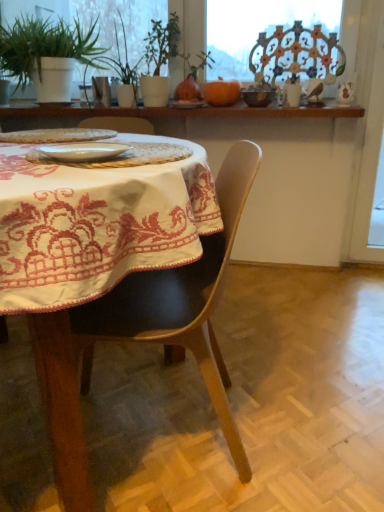
Identify the location of white glossy plate at center, arranged as the second tableware when viewed from the back. (82, 151).

How much space does white glossy plate at center, which appears as the 1th tableware when viewed from the front, occupy horizontally?

white glossy plate at center, which appears as the 1th tableware when viewed from the front, is 7.66 inches wide.

What is the approximate width of matte brown bowl at upper center, which is the first tableware in top-to-bottom order?

It is 6.56 inches.

Find the location of a particular element. This screenshot has width=384, height=512. matte brown bowl at upper center, which is the 2th tableware from left to right is located at coordinates (259, 94).

This screenshot has height=512, width=384. Find the location of `black leather chair at center`. black leather chair at center is located at coordinates (143, 333).

Where is `orange matte pumpkin at upper center`? Image resolution: width=384 pixels, height=512 pixels. orange matte pumpkin at upper center is located at coordinates (221, 92).

You are a GUI agent. You are given a task and a screenshot of the screen. Output one action in this format:
    pyautogui.click(x=<x>, y=<y>)
    Task: Click on the green matte plant at upper left
    
    Given the screenshot: What is the action you would take?
    pyautogui.click(x=47, y=54)

Image resolution: width=384 pixels, height=512 pixels. What do you see at coordinates (97, 224) in the screenshot?
I see `white embroidered tablecloth at center` at bounding box center [97, 224].

You are a GUI agent. You are given a task and a screenshot of the screen. Output one action in this format:
    pyautogui.click(x=<x>, y=<y>)
    Task: Click on the white glossy plate at center, which is the 1th tableware from left to right
    Image resolution: width=384 pixels, height=512 pixels.
    Given the screenshot: What is the action you would take?
    pyautogui.click(x=82, y=151)

Between green matte plant at upper left and black leather chair at center, which one appears on the left side from the viewer's perspective?

From the viewer's perspective, green matte plant at upper left appears more on the left side.

Considering the relative sizes of green matte plant at upper left and black leather chair at center in the image provided, is green matte plant at upper left bigger than black leather chair at center?

Actually, green matte plant at upper left might be smaller than black leather chair at center.

Consider the image. Does green matte plant at upper left have a greater width compared to black leather chair at center?

Incorrect, the width of green matte plant at upper left does not surpass that of black leather chair at center.

Is white embroidered tablecloth at center located outside green matte plant at upper left?

Yes, white embroidered tablecloth at center is not within green matte plant at upper left.

Which object is closer to the camera, white embroidered tablecloth at center or green matte plant at upper left?

white embroidered tablecloth at center is in front.

Is white embroidered tablecloth at center bigger than green matte plant at upper left?

Correct, white embroidered tablecloth at center is larger in size than green matte plant at upper left.

How many degrees apart are the facing directions of white embroidered tablecloth at center and green matte plant at upper left?

There is a 1.5-degree angle between the facing directions of white embroidered tablecloth at center and green matte plant at upper left.

Is white glossy plate at center, which is counted as the second tableware, starting from the right, aimed at matte brown bowl at upper center, acting as the second tableware starting from the front?

No, white glossy plate at center, which is counted as the second tableware, starting from the right, is not aimed at matte brown bowl at upper center, acting as the second tableware starting from the front.

Does white glossy plate at center, which is the 1th tableware from left to right, have a larger size compared to matte brown bowl at upper center, which is the 1th tableware from back to front?

No, white glossy plate at center, which is the 1th tableware from left to right, is not bigger than matte brown bowl at upper center, which is the 1th tableware from back to front.

Locate an element on the screen. tableware that appears on the left of matte brown bowl at upper center, the second tableware positioned from the bottom is located at coordinates (82, 151).

Is point (86, 108) less distant than point (216, 96)?

That is False.

Are wooden shelf at upper center and orange matte pumpkin at upper center far apart?

No, wooden shelf at upper center is not far from orange matte pumpkin at upper center.

Which object is thinner, wooden shelf at upper center or orange matte pumpkin at upper center?

orange matte pumpkin at upper center.

From the image's perspective, would you say wooden shelf at upper center is positioned over orange matte pumpkin at upper center?

No, from the image's perspective, wooden shelf at upper center is not above orange matte pumpkin at upper center.

Considering the relative sizes of green matte plant at upper left and green leafy plant at upper center in the image provided, is green matte plant at upper left thinner than green leafy plant at upper center?

No, green matte plant at upper left is not thinner than green leafy plant at upper center.

Is green matte plant at upper left placed right next to green leafy plant at upper center?

No, green matte plant at upper left is not with green leafy plant at upper center.

Measure the distance from green matte plant at upper left to green leafy plant at upper center.

The distance of green matte plant at upper left from green leafy plant at upper center is 24.50 centimeters.

In the image, is green matte plant at upper left on the left side or the right side of green leafy plant at upper center?

Clearly, green matte plant at upper left is on the left of green leafy plant at upper center in the image.

What's the angular difference between white glossy plate at center, which is counted as the second tableware, starting from the right, and orange matte pumpkin at upper center's facing directions?

white glossy plate at center, which is counted as the second tableware, starting from the right, and orange matte pumpkin at upper center are facing 13.7 degrees away from each other.

Is white glossy plate at center, which appears as the 1th tableware when viewed from the front, turned away from orange matte pumpkin at upper center?

white glossy plate at center, which appears as the 1th tableware when viewed from the front, does not have its back to orange matte pumpkin at upper center.

From a real-world perspective, who is located higher, white glossy plate at center, which is counted as the second tableware, starting from the right, or orange matte pumpkin at upper center?

In real-world perspective, orange matte pumpkin at upper center is above.

Does white glossy plate at center, which ranks as the second tableware in top-to-bottom order, have a lesser height compared to orange matte pumpkin at upper center?

Yes, white glossy plate at center, which ranks as the second tableware in top-to-bottom order, is shorter than orange matte pumpkin at upper center.

From the image's perspective, which is below, matte brown bowl at upper center, the second tableware positioned from the bottom, or green matte plant at upper left?

matte brown bowl at upper center, the second tableware positioned from the bottom, is shown below in the image.

From a real-world perspective, which is physically below, matte brown bowl at upper center, which is the 2th tableware from left to right, or green matte plant at upper left?

From a 3D spatial view, matte brown bowl at upper center, which is the 2th tableware from left to right, is below.

Who is more distant, matte brown bowl at upper center, placed as the first tableware when sorted from right to left, or green matte plant at upper left?

matte brown bowl at upper center, placed as the first tableware when sorted from right to left.

In the scene shown: Is matte brown bowl at upper center, the second tableware positioned from the bottom, aimed at green matte plant at upper left?

No, matte brown bowl at upper center, the second tableware positioned from the bottom, is not aimed at green matte plant at upper left.

The image size is (384, 512). I want to click on chair in front of the green matte plant at upper left, so click(143, 333).

Find the location of a particular element. houseplant behind the white embroidered tablecloth at center is located at coordinates (47, 54).

Considering their positions, is white glossy plate at center, which is counted as the second tableware, starting from the right, positioned closer to orange matte pumpkin at upper center than green leafy plant at upper center?

green leafy plant at upper center.

When comparing their distances from wooden shelf at upper center, does black leather chair at center or white embroidered tablecloth at center seem further?

Based on the image, white embroidered tablecloth at center appears to be further to wooden shelf at upper center.

Looking at the image, which one is located closer to white embroidered tablecloth at center, matte brown bowl at upper center, the second tableware positioned from the bottom, or orange matte pumpkin at upper center?

Based on the image, matte brown bowl at upper center, the second tableware positioned from the bottom, appears to be nearer to white embroidered tablecloth at center.

Considering their positions, is wooden shelf at upper center positioned further to black leather chair at center than white glossy plate at center, which is counted as the second tableware, starting from the right?

Among the two, wooden shelf at upper center is located further to black leather chair at center.

Considering their positions, is matte brown bowl at upper center, which is the 2th tableware from left to right, positioned further to green leafy plant at upper center than white glossy plate at center, which ranks as the second tableware in top-to-bottom order?

Among the two, white glossy plate at center, which ranks as the second tableware in top-to-bottom order, is located further to green leafy plant at upper center.

From the image, which object appears to be farther from white embroidered tablecloth at center, black leather chair at center or wooden shelf at upper center?

The object further to white embroidered tablecloth at center is wooden shelf at upper center.

Based on their spatial positions, is white embroidered tablecloth at center or matte brown bowl at upper center, the second tableware positioned from the bottom, closer to green leafy plant at upper center?

matte brown bowl at upper center, the second tableware positioned from the bottom, is closer to green leafy plant at upper center.

Considering their positions, is green matte plant at upper left positioned further to white glossy plate at center, which is counted as the second tableware, starting from the right, than orange matte pumpkin at upper center?

green matte plant at upper left lies further to white glossy plate at center, which is counted as the second tableware, starting from the right, than the other object.

You are a GUI agent. You are given a task and a screenshot of the screen. Output one action in this format:
    pyautogui.click(x=<x>, y=<y>)
    Task: Click on the pumpkin located between wooden shelf at upper center and matte brown bowl at upper center, placed as the first tableware when sorted from right to left, in the left-right direction
    The height and width of the screenshot is (512, 384).
    Given the screenshot: What is the action you would take?
    pyautogui.click(x=221, y=92)

Where is `houseplant between white embroidered tablecloth at center and matte brown bowl at upper center, placed as the first tableware when sorted from right to left, along the z-axis`? houseplant between white embroidered tablecloth at center and matte brown bowl at upper center, placed as the first tableware when sorted from right to left, along the z-axis is located at coordinates (47, 54).

This screenshot has width=384, height=512. What are the coordinates of `houseplant positioned between black leather chair at center and orange matte pumpkin at upper center from near to far` in the screenshot? It's located at (47, 54).

The width and height of the screenshot is (384, 512). Identify the location of houseplant between white embroidered tablecloth at center and orange matte pumpkin at upper center along the z-axis. (47, 54).